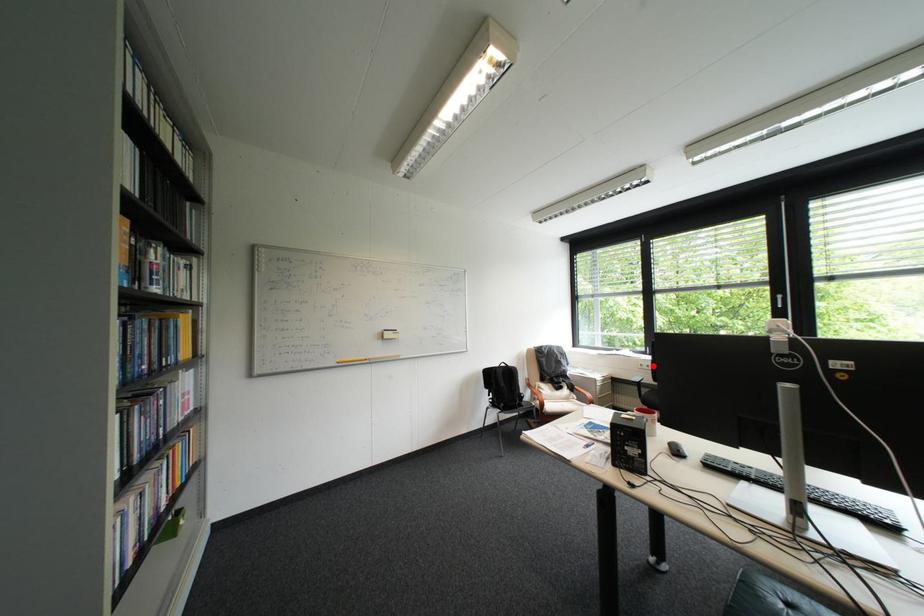
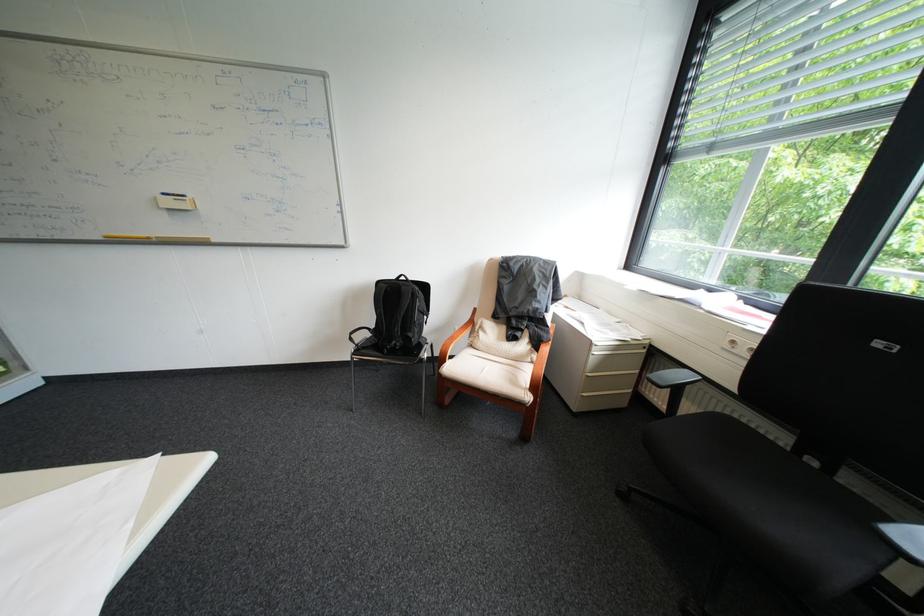
Find the pixel in the second image that matches the highlighted location in the first image.

(746, 342)